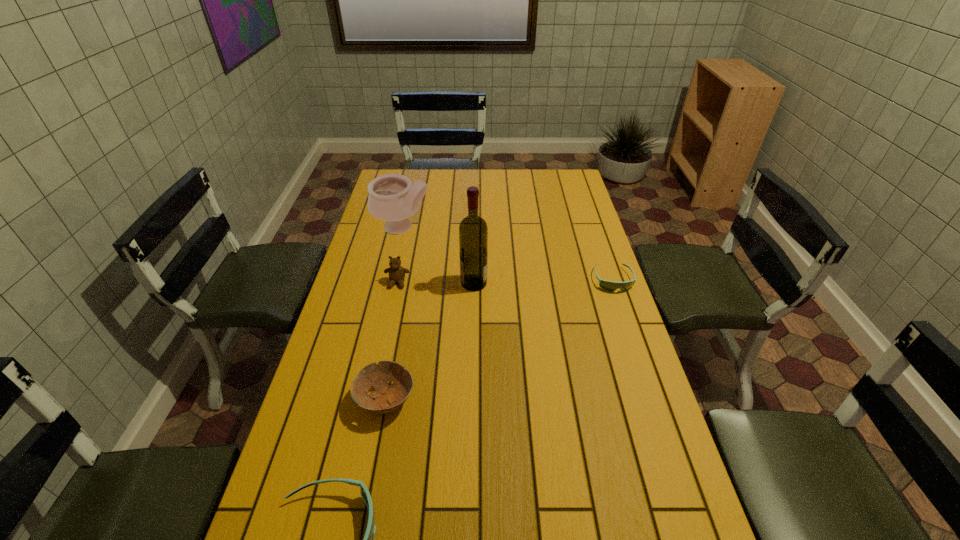
Find the location of a particular element. This screenshot has height=540, width=960. the right goggles is located at coordinates (611, 286).

The width and height of the screenshot is (960, 540). In order to click on the rightmost object in this screenshot , I will do `click(611, 286)`.

This screenshot has height=540, width=960. Find the location of `teddy bear`. teddy bear is located at coordinates (396, 272).

Find the location of a particular element. This screenshot has height=540, width=960. the tallest object is located at coordinates (473, 232).

What are the coordinates of `alcohol` in the screenshot? It's located at (473, 232).

You are a GUI agent. You are given a task and a screenshot of the screen. Output one action in this format:
    pyautogui.click(x=<x>, y=<y>)
    Task: Click on the fifth shortest object
    The width and height of the screenshot is (960, 540).
    Given the screenshot: What is the action you would take?
    pyautogui.click(x=392, y=198)

Locate an element on the screen. Image resolution: width=960 pixels, height=540 pixels. pottery is located at coordinates (392, 198).

Identify the location of bowl. (387, 398).

The width and height of the screenshot is (960, 540). Identify the location of vacant space located on the front-facing side of the rightmost object. (632, 335).

This screenshot has height=540, width=960. In order to click on vacant space located 0.160m on the front-facing side of the teddy bear in this screenshot , I will do `click(389, 325)`.